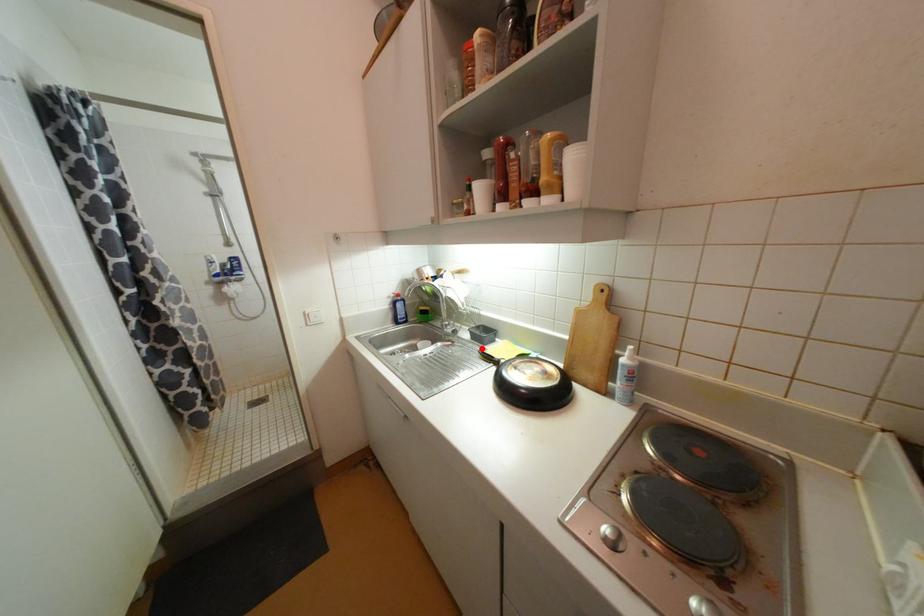
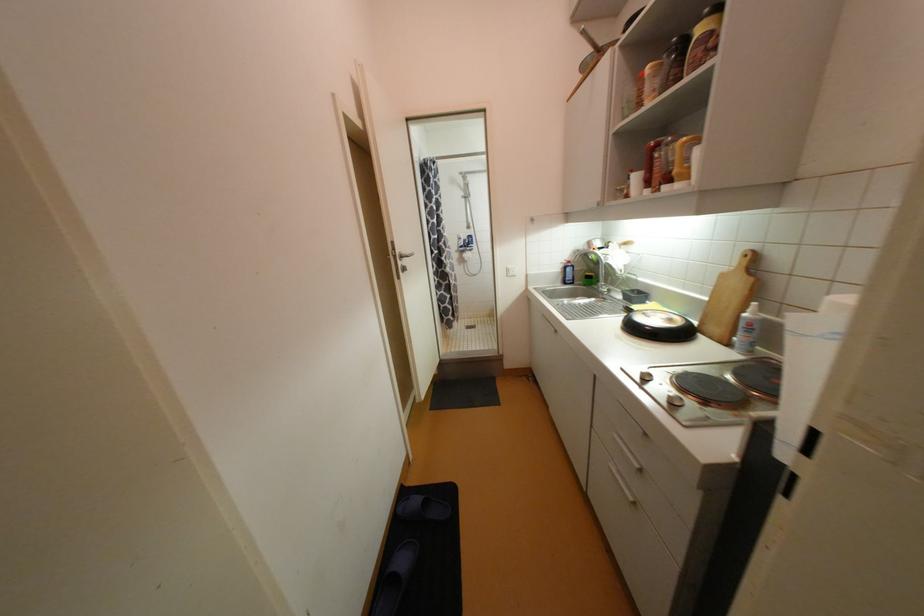
Where in the second image is the point corresponding to the highlighted location from the first image?

(628, 305)